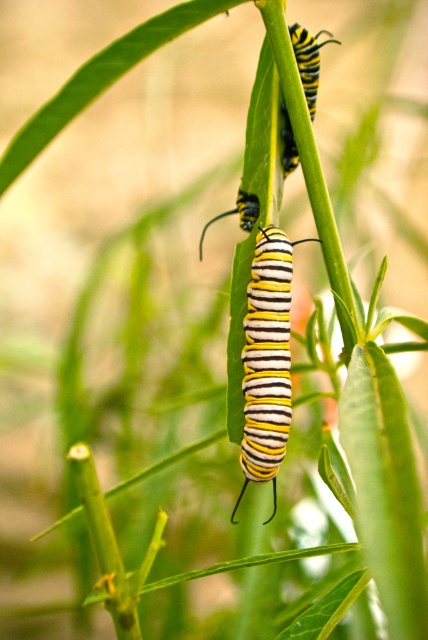
You are observing a plant stem with two monarch caterpillars. You see a point marked at coordinates (267, 360). Which caterpillar does this point correspond to?

The point at (267, 360) corresponds to the yellow striped caterpillar at center.